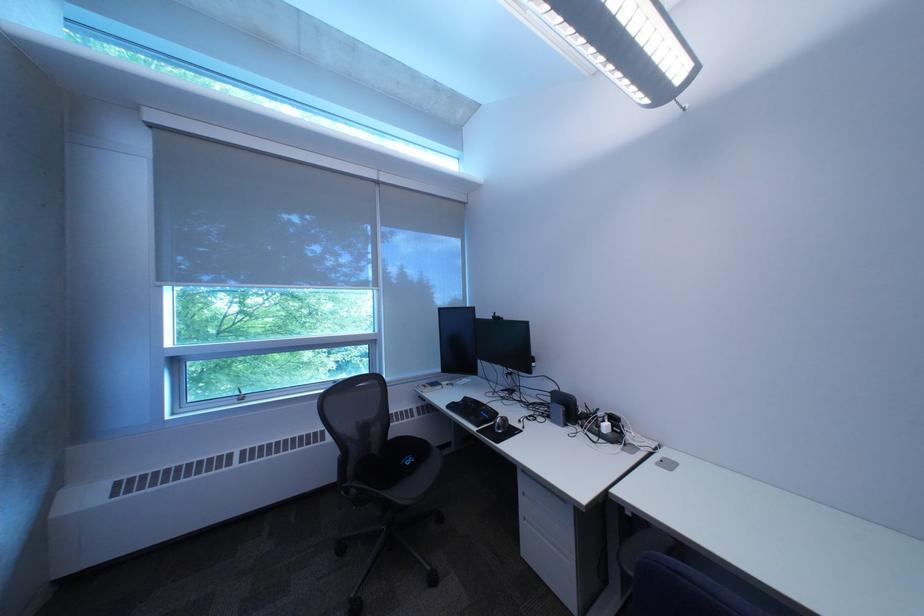
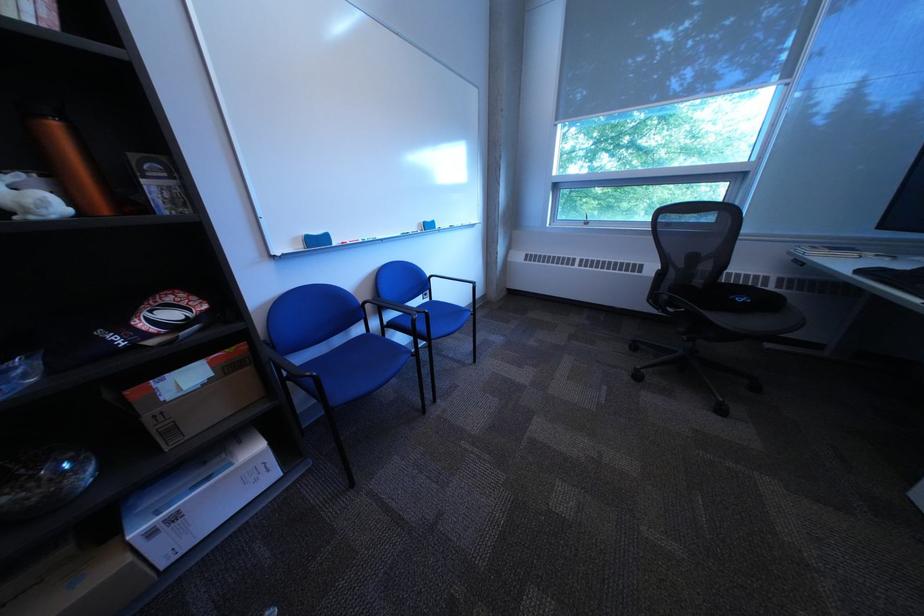
The first image is from the beginning of the video and the second image is from the end. How did the camera likely rotate when shooting the video?

The camera rotated toward left-down.